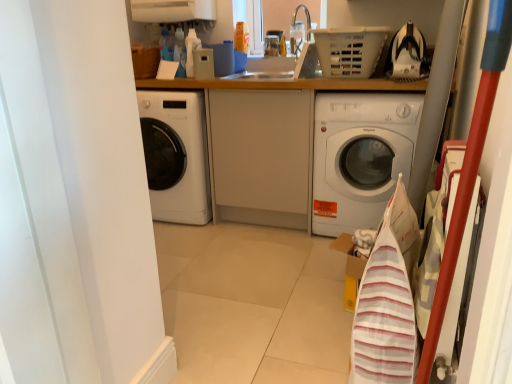
Question: Would you say white glossy washing machine at center is to the left or to the right of white plastic basket at upper center in the picture?

Choices:
 (A) left
 (B) right

Answer: (B)

Question: Is point (382, 94) closer or farther from the camera than point (367, 49)?

Choices:
 (A) farther
 (B) closer

Answer: (A)

Question: Based on their sizes in the image, would you say white glossy washing machine at center is bigger or smaller than white plastic basket at upper center?

Choices:
 (A) small
 (B) big

Answer: (B)

Question: Choose the correct answer: Is white plastic basket at upper center inside white glossy washing machine at center or outside it?

Choices:
 (A) inside
 (B) outside

Answer: (B)

Question: Considering the positions of point (338, 56) and point (385, 198), is point (338, 56) closer or farther from the camera than point (385, 198)?

Choices:
 (A) closer
 (B) farther

Answer: (A)

Question: From a real-world perspective, is white plastic basket at upper center physically located above or below white glossy washing machine at center?

Choices:
 (A) above
 (B) below

Answer: (A)

Question: In the image, is white plastic basket at upper center positioned in front of or behind white glossy washing machine at center?

Choices:
 (A) behind
 (B) front

Answer: (B)